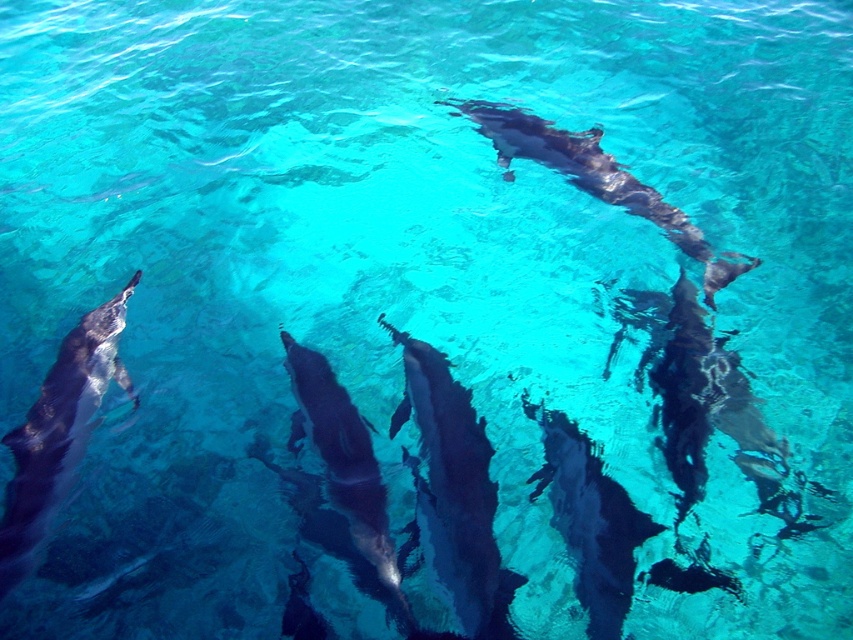
Looking at this image, can you confirm if glossy dark gray dolphin at center is positioned to the right of shiny dark gray dolphin at center?

Yes, glossy dark gray dolphin at center is to the right of shiny dark gray dolphin at center.

Is point (436, 394) closer to viewer compared to point (340, 509)?

No, (436, 394) is behind (340, 509).

Find the location of `glossy dark gray dolphin at center`. glossy dark gray dolphin at center is located at coordinates (456, 490).

Image resolution: width=853 pixels, height=640 pixels. Identify the location of glossy dark gray dolphin at center. (456, 490).

Does smooth gray dolphin at center come in front of shiny dark gray dolphin at center?

Yes, it is in front of shiny dark gray dolphin at center.

Which is behind, point (583, 461) or point (383, 509)?

The point (583, 461) is behind.

I want to click on smooth gray dolphin at center, so click(x=589, y=520).

Which is above, shiny dark gray dolphin at lower left or smooth gray dolphin at center?

shiny dark gray dolphin at lower left is above.

Does shiny dark gray dolphin at lower left have a smaller size compared to smooth gray dolphin at center?

Incorrect, shiny dark gray dolphin at lower left is not smaller in size than smooth gray dolphin at center.

In the scene shown: Who is more forward, (44, 460) or (589, 632)?

Point (589, 632) is more forward.

I want to click on shiny dark gray dolphin at lower left, so click(57, 433).